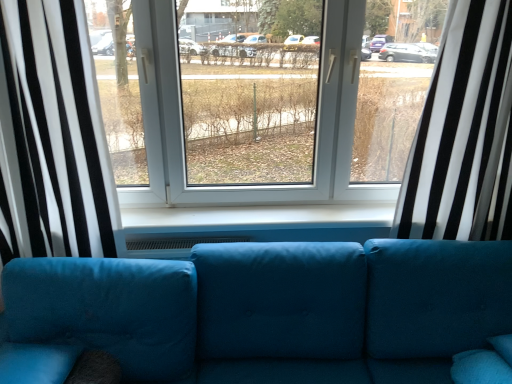
Question: In terms of height, does white striped curtain at right, the 1th curtain when ordered from right to left, look taller or shorter compared to black/white striped curtain at left, the second curtain positioned from the right?

Choices:
 (A) tall
 (B) short

Answer: (B)

Question: From the image's perspective, is white striped curtain at right, the 1th curtain when ordered from right to left, above or below black/white striped curtain at left, marked as the 1th curtain in a left-to-right arrangement?

Choices:
 (A) above
 (B) below

Answer: (A)

Question: Which object is the closest to the white striped curtain at right, which is the second curtain from left to right?

Choices:
 (A) velvet blue couch at center
 (B) black/white striped curtain at left, marked as the 1th curtain in a left-to-right arrangement

Answer: (A)

Question: Which of these objects is positioned farthest from the velvet blue couch at center?

Choices:
 (A) black/white striped curtain at left, marked as the 1th curtain in a left-to-right arrangement
 (B) white striped curtain at right, the 1th curtain when ordered from right to left

Answer: (A)